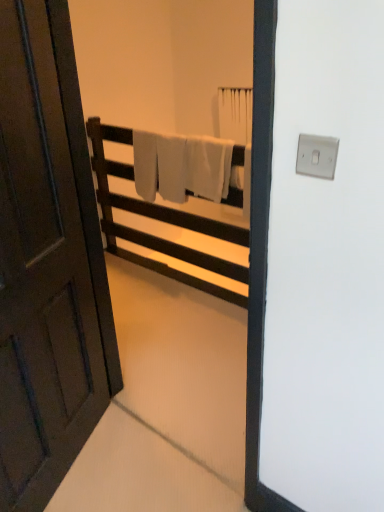
Locate an element on the screen. free space in front of white matte towel rack at center is located at coordinates (174, 323).